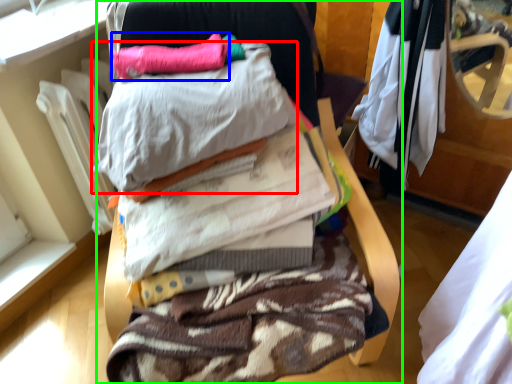
Question: Considering the real-world distances, which object is closest to pillow (highlighted by a red box)? pillow (highlighted by a blue box) or furniture (highlighted by a green box).

Choices:
 (A) pillow
 (B) furniture

Answer: (A)